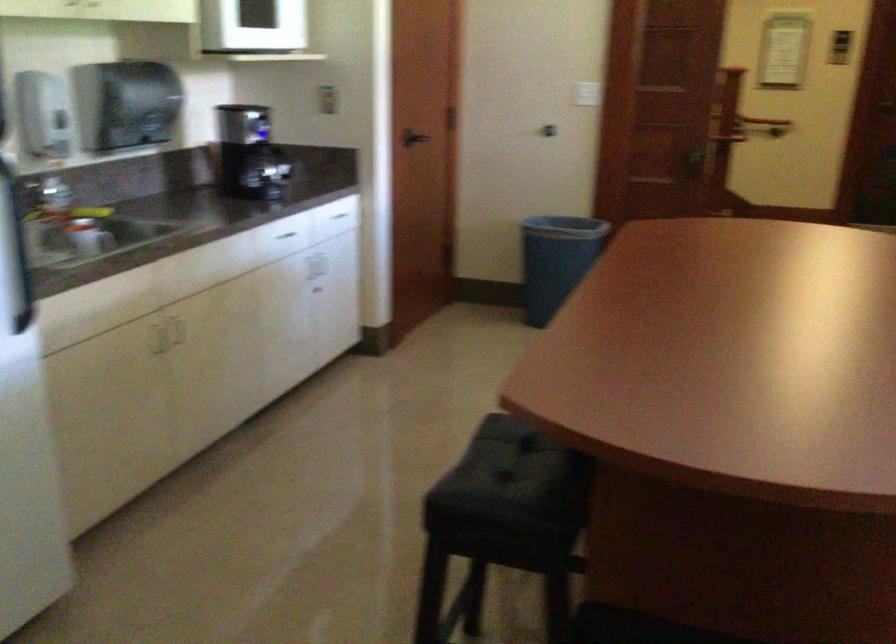
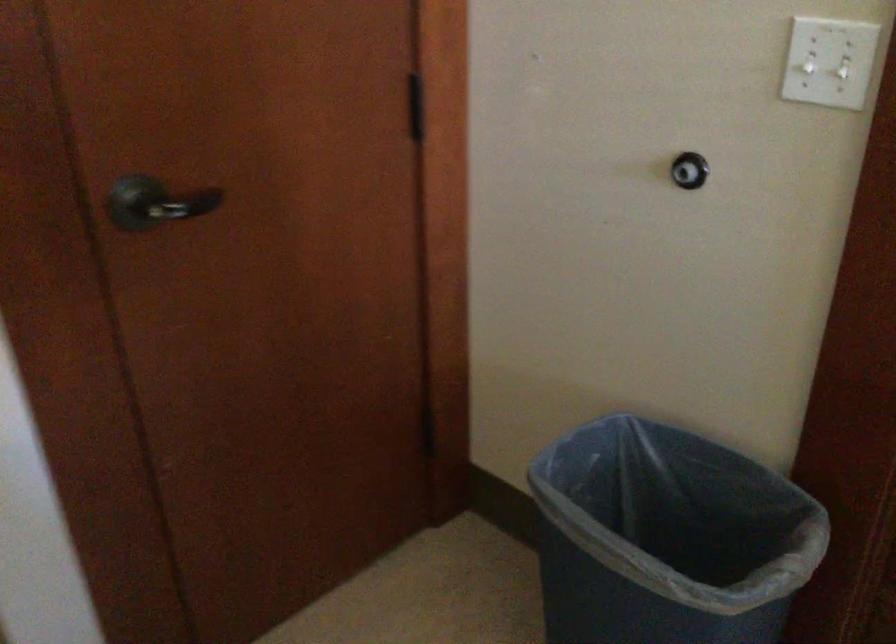
Where in the second image is the point corresponding to pixel 418 128 from the first image?

(156, 203)